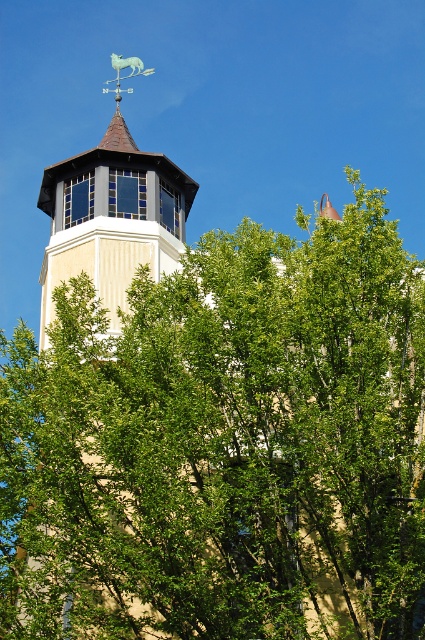
Between point (107, 173) and point (152, 68), which one is positioned behind?

Positioned behind is point (152, 68).

Where is `green copper weather vane at upper center`? green copper weather vane at upper center is located at coordinates (112, 212).

The height and width of the screenshot is (640, 425). What are the coordinates of `green leafy tree at center` in the screenshot? It's located at (223, 445).

Does green leafy tree at center appear on the left side of metallic blue horse at upper center?

Incorrect, green leafy tree at center is not on the left side of metallic blue horse at upper center.

Image resolution: width=425 pixels, height=640 pixels. In order to click on green leafy tree at center in this screenshot , I will do `click(223, 445)`.

Is green leafy tree at center in front of green copper weather vane at upper center?

That is True.

Is green leafy tree at center shorter than green copper weather vane at upper center?

Correct, green leafy tree at center is not as tall as green copper weather vane at upper center.

Does point (212, 586) come behind point (107, 298)?

No, it is not.

You are a GUI agent. You are given a task and a screenshot of the screen. Output one action in this format:
    pyautogui.click(x=<x>, y=<y>)
    Task: Click on the green leafy tree at center
    The height and width of the screenshot is (640, 425).
    Given the screenshot: What is the action you would take?
    pyautogui.click(x=223, y=445)